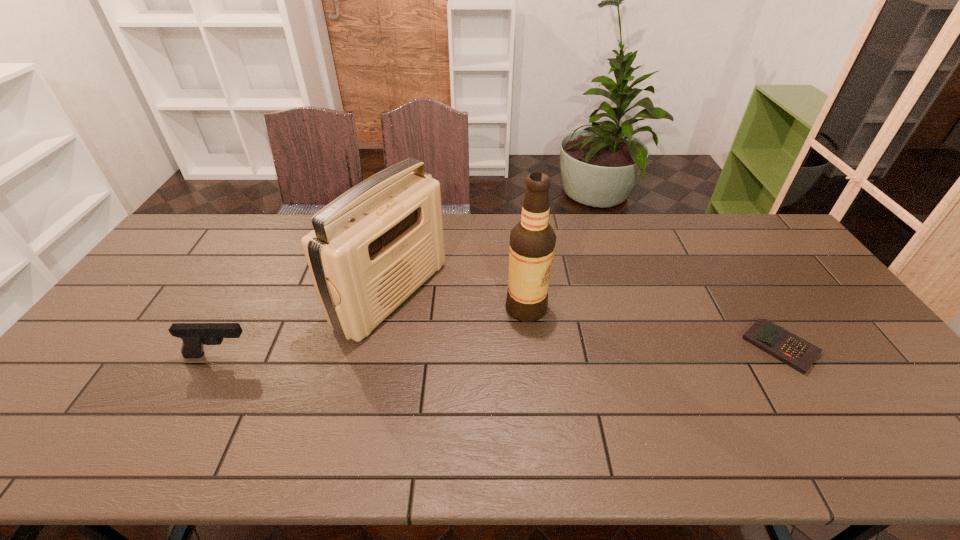
The height and width of the screenshot is (540, 960). Find the location of `free spot between the second shortest object and the rightmost object`. free spot between the second shortest object and the rightmost object is located at coordinates (500, 352).

Identify the location of empty space that is in between the leftmost object and the alcohol. (372, 332).

Locate an element on the screen. Image resolution: width=960 pixels, height=540 pixels. empty location between the second object from right to left and the calculator is located at coordinates (654, 328).

Identify the location of free space between the second shortest object and the rightmost object. (500, 352).

I want to click on free space between the shortest object and the second object from right to left, so click(x=654, y=328).

At what (x,y) coordinates should I click in order to perform the action: click on vacant area that lies between the alcohol and the leftmost object. Please return your answer as a coordinate pair (x, y). The image size is (960, 540). Looking at the image, I should click on (372, 332).

This screenshot has height=540, width=960. I want to click on empty space between the radio receiver and the shortest object, so click(x=587, y=321).

Locate an element on the screen. Image resolution: width=960 pixels, height=540 pixels. vacant space in between the second object from left to right and the leftmost object is located at coordinates (305, 325).

The image size is (960, 540). In order to click on free spot between the pistol and the second object from right to left in this screenshot , I will do `click(372, 332)`.

Image resolution: width=960 pixels, height=540 pixels. I want to click on vacant area that lies between the radio receiver and the third tallest object, so click(x=305, y=325).